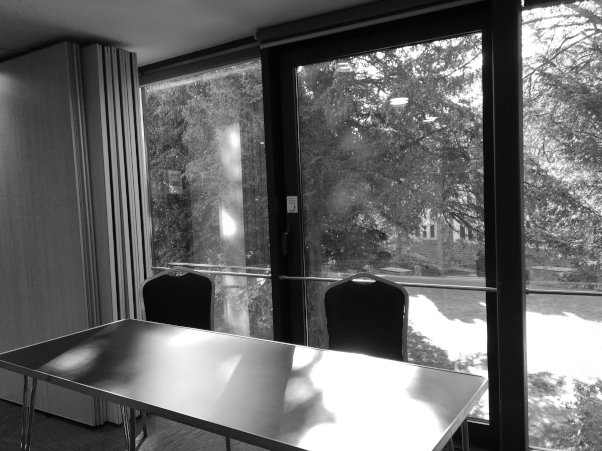
The image size is (602, 451). In order to click on table in this screenshot , I will do `click(134, 376)`.